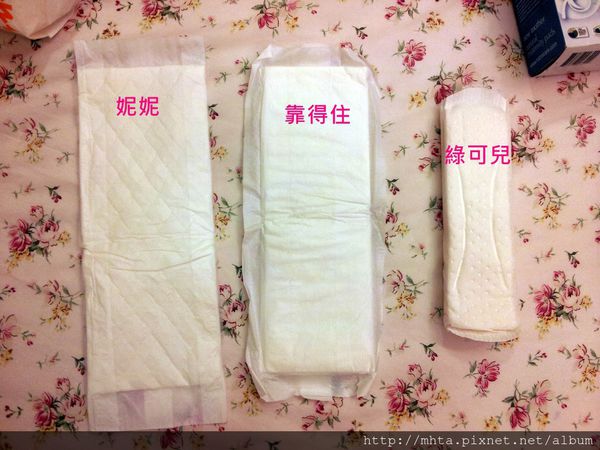
Where is `cardboard box`? The height and width of the screenshot is (450, 600). cardboard box is located at coordinates (562, 33).